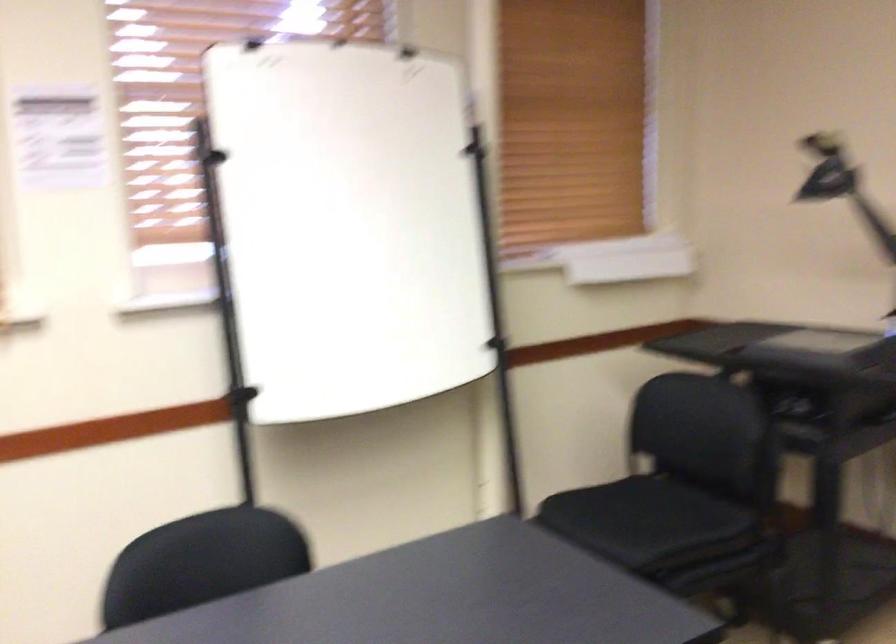
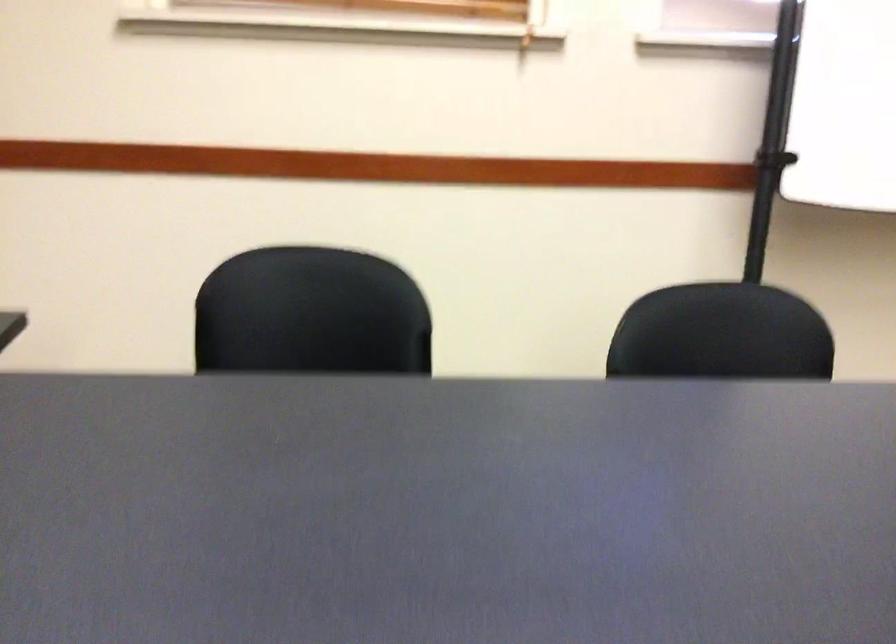
The images are taken continuously from a first-person perspective. In which direction is your viewpoint rotating?

The camera rotated toward left-down.